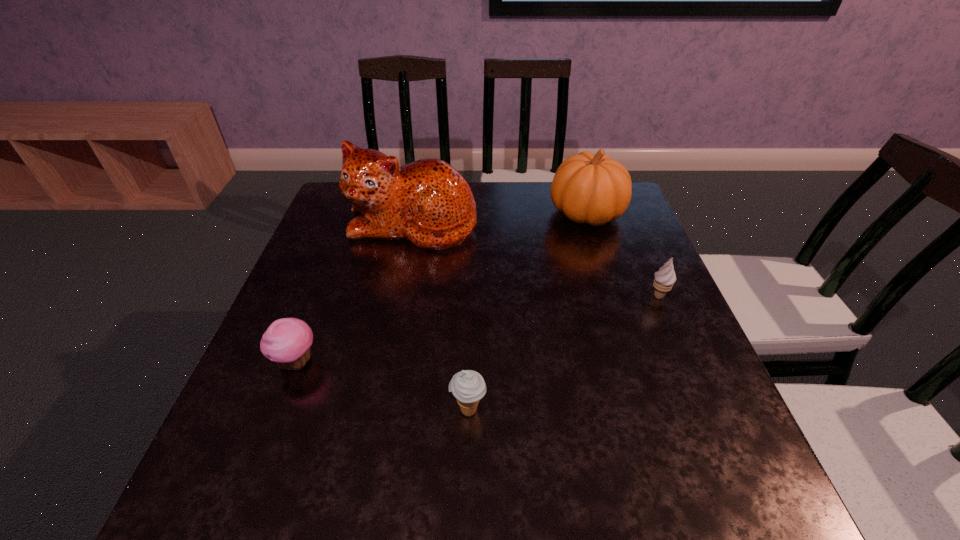
What are the coordinates of `vacant area at the far edge` in the screenshot? It's located at (535, 184).

Locate an element on the screen. The height and width of the screenshot is (540, 960). vacant region at the left edge of the desktop is located at coordinates (345, 296).

Where is `vacant space at the right edge of the desktop`? vacant space at the right edge of the desktop is located at coordinates point(693,370).

Locate an element on the screen. The width and height of the screenshot is (960, 540). vacant space that is in between the fourth shortest object and the cat is located at coordinates pyautogui.click(x=500, y=218).

The width and height of the screenshot is (960, 540). In order to click on empty space that is in between the nearest object and the pumpkin in this screenshot , I will do `click(527, 312)`.

At what (x,y) coordinates should I click in order to perform the action: click on free space between the cupcake and the third farthest object. Please return your answer as a coordinate pair (x, y). This screenshot has height=540, width=960. Looking at the image, I should click on (478, 329).

Find the location of a particular element. This screenshot has height=540, width=960. vacant space that is in between the cat and the farther icecream is located at coordinates (536, 260).

The height and width of the screenshot is (540, 960). I want to click on unoccupied area between the cat and the nearer icecream, so click(441, 316).

This screenshot has height=540, width=960. I want to click on free space that is in between the cat and the pumpkin, so tap(500, 218).

Where is `empty space between the left icecream and the cupcake`? Image resolution: width=960 pixels, height=540 pixels. empty space between the left icecream and the cupcake is located at coordinates (382, 386).